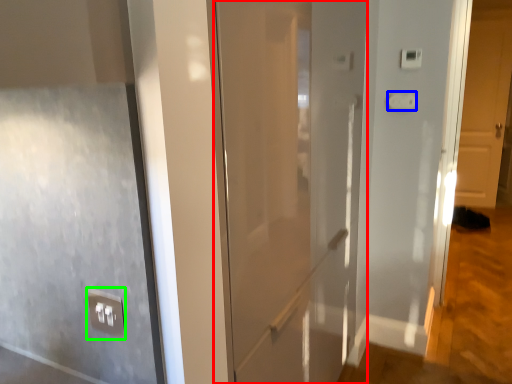
Question: Which object is positioned closest to door (highlighted by a red box)? Select from light switch (highlighted by a blue box) and electric outlet (highlighted by a green box).

Choices:
 (A) light switch
 (B) electric outlet

Answer: (B)